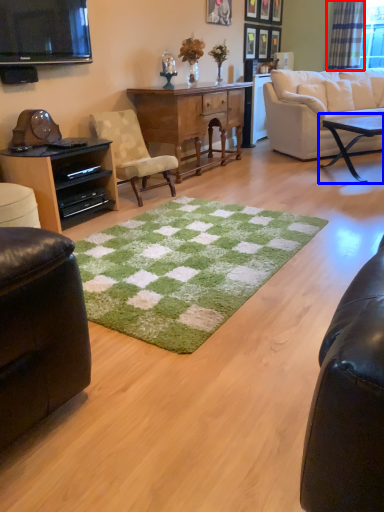
Question: Which of the following is the closest to the observer, curtain (highlighted by a red box) or coffee table (highlighted by a blue box)?

Choices:
 (A) curtain
 (B) coffee table

Answer: (B)